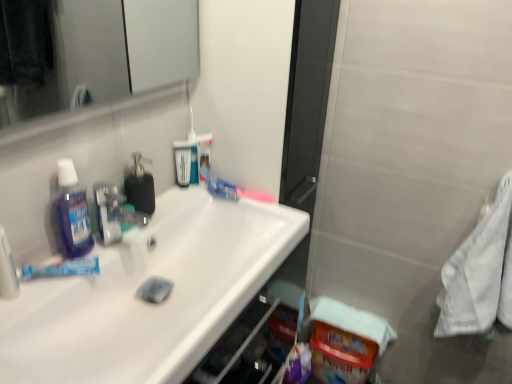
Identify the location of free space to the left of pink plastic toothbrush at upper center, the first toothbrush in the right-to-left sequence. (203, 206).